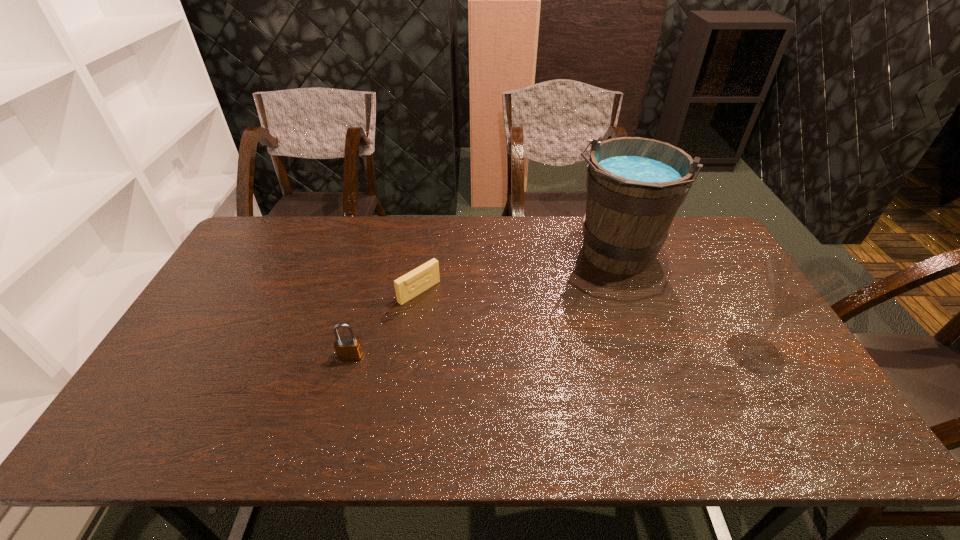
This screenshot has width=960, height=540. Find the location of `vacant space at the far edge`. vacant space at the far edge is located at coordinates [x=511, y=254].

I want to click on vacant region at the near edge of the desktop, so click(x=508, y=410).

Locate an element on the screen. The image size is (960, 540). vacant space at the left edge is located at coordinates (192, 328).

The height and width of the screenshot is (540, 960). What are the coordinates of `vacant space at the right edge` in the screenshot? It's located at (725, 328).

I want to click on vacant space at the near left corner, so click(x=162, y=407).

This screenshot has width=960, height=540. Identify the location of free space between the second tallest object and the third object from right to left. (588, 322).

This screenshot has height=540, width=960. In order to click on vacant point located between the third object from right to left and the wine bucket in this screenshot , I will do `click(517, 274)`.

Locate an element on the screen. The width and height of the screenshot is (960, 540). free area in between the wine bucket and the flute glass is located at coordinates pyautogui.click(x=684, y=305).

What are the coordinates of `empty space that is in between the leftmost object and the third object from right to left` in the screenshot? It's located at click(385, 324).

At what (x,y) coordinates should I click in order to perform the action: click on vacant area that lies between the second shortest object and the third object from left to right. Please return your answer as a coordinate pair (x, y). The height and width of the screenshot is (540, 960). Looking at the image, I should click on (483, 306).